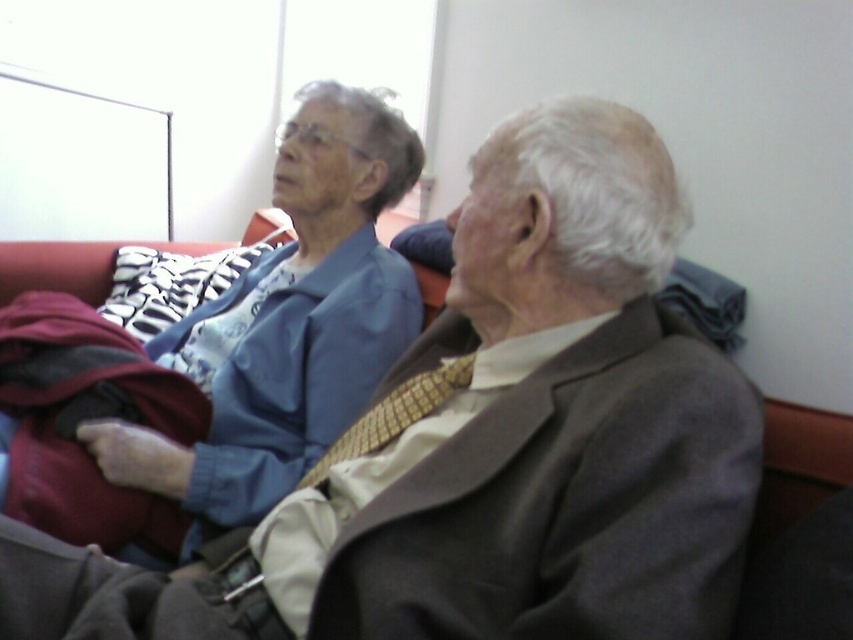
Between blue fabric at left and yellow textured tie at center, which one appears on the left side from the viewer's perspective?

blue fabric at left

Which of these two, blue fabric at left or yellow textured tie at center, stands taller?

blue fabric at left is taller.

You are a GUI agent. You are given a task and a screenshot of the screen. Output one action in this format:
    pyautogui.click(x=<x>, y=<y>)
    Task: Click on the blue fabric at left
    This screenshot has height=640, width=853.
    Given the screenshot: What is the action you would take?
    pyautogui.click(x=288, y=321)

The height and width of the screenshot is (640, 853). I want to click on blue fabric at left, so click(288, 321).